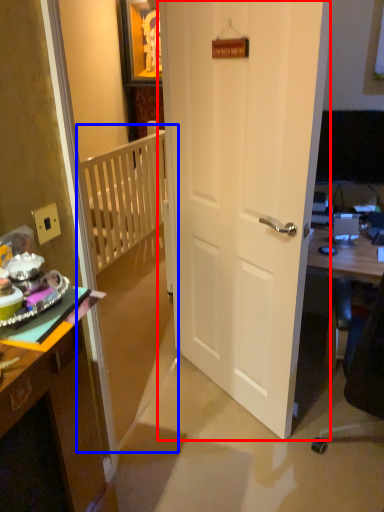
Question: Which of the following is the farthest to the observer, door (highlighted by a red box) or bunk bed (highlighted by a blue box)?

Choices:
 (A) door
 (B) bunk bed

Answer: (A)